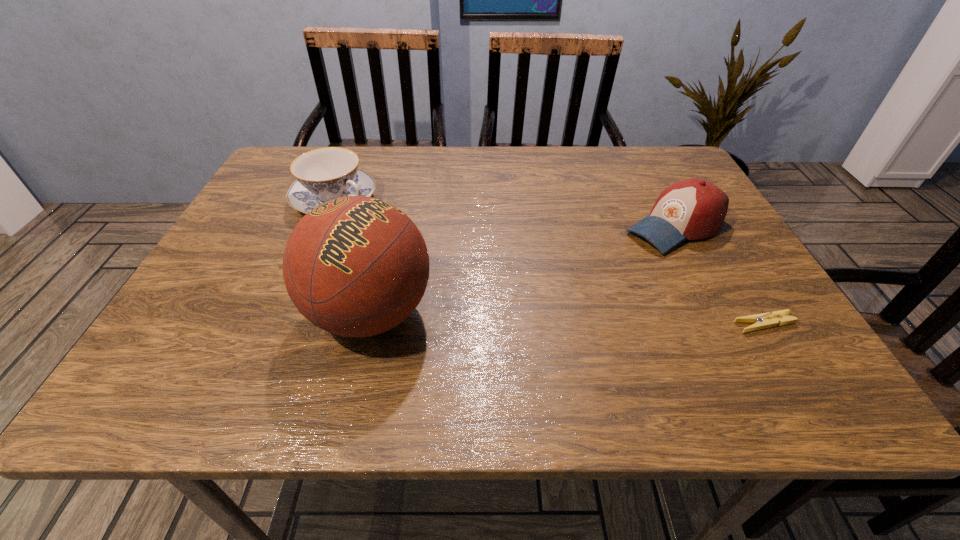
Image resolution: width=960 pixels, height=540 pixels. What are the coordinates of `empty space that is in between the tallest object and the clothespin` in the screenshot? It's located at (567, 319).

The width and height of the screenshot is (960, 540). I want to click on vacant space in between the baseball cap and the shortest object, so click(x=720, y=275).

This screenshot has height=540, width=960. In order to click on free area in between the tallest object and the shortest object in this screenshot , I will do `click(567, 319)`.

Image resolution: width=960 pixels, height=540 pixels. Identify the location of free space between the shortest object and the basketball. (567, 319).

Where is `free point between the chinaware and the baseball cap`? The height and width of the screenshot is (540, 960). free point between the chinaware and the baseball cap is located at coordinates (505, 214).

What are the coordinates of `vacant space that's between the baseball cap and the clothespin` in the screenshot? It's located at (720, 275).

Locate which object ranks second in proximity to the tallest object. Please provide its 2D coordinates. Your answer should be formatted as a tuple, i.e. [(x, y)], where the tuple contains the x and y coordinates of a point satisfying the conditions above.

[(691, 209)]

Locate an element on the screen. The width and height of the screenshot is (960, 540). object that is the third closest to the clothespin is located at coordinates (324, 174).

What are the coordinates of `vacant space that satisfies the following two spatial constraints: 1. on the front side of the chinaware; 2. on the right side of the baseball cap` in the screenshot? It's located at (324, 227).